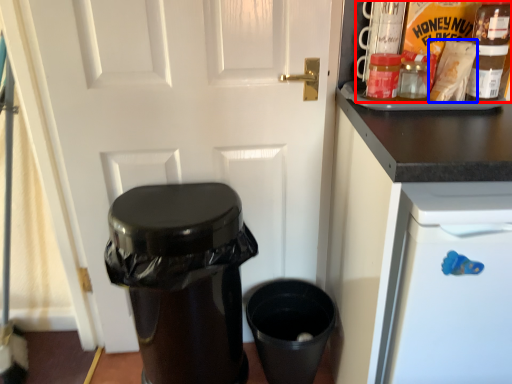
Question: Which object appears closest to the camera in this image, food (highlighted by a red box) or food (highlighted by a blue box)?

Choices:
 (A) food
 (B) food

Answer: (B)